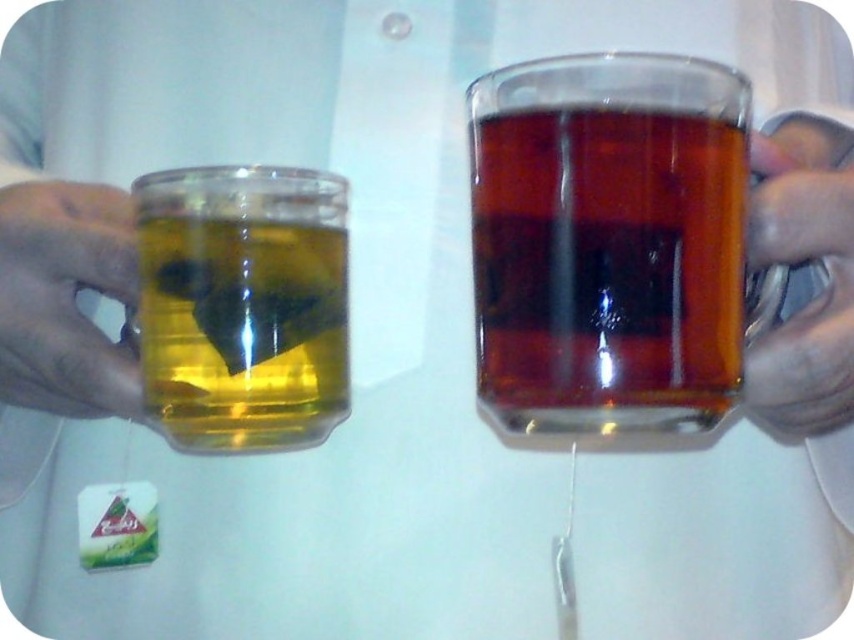
You are organizing a small desk space and need to place both the translucent glass mug at right and the matte silver pen at right. Since the desk has limited space, which object should you place first to ensure both fit properly?

The translucent glass mug at right occupies less space than the matte silver pen at right, so you should place the matte silver pen at right first to ensure there is enough space for both items.

You are a barista preparing two different teas. You have a translucent glass mug at right and a translucent glass tea bag at left. Which of these two items can hold more liquid?

The translucent glass mug at right can hold more liquid because its width is larger than the translucent glass tea bag at left.

You are a tea enthusiast observing two mugs. The translucent glass mug at right contains black tea, and the translucent glass tea bag at left has green tea. If you want to pour the contents of the mug into the tea bag, is it possible based on their positions?

The translucent glass mug at right is located above the translucent glass tea bag at left, so pouring the contents from the mug into the tea bag would be possible due to the vertical positioning.